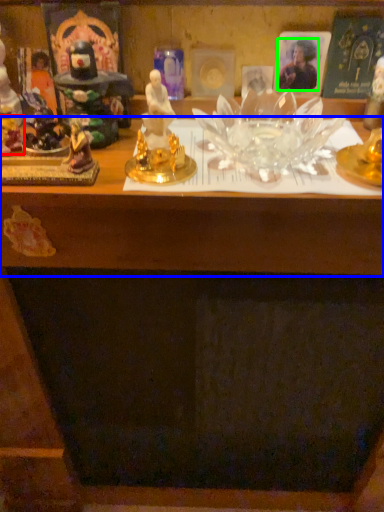
Question: Considering the real-world distances, which object is farthest from toy (highlighted by a red box)? table (highlighted by a blue box) or person (highlighted by a green box)?

Choices:
 (A) table
 (B) person

Answer: (B)